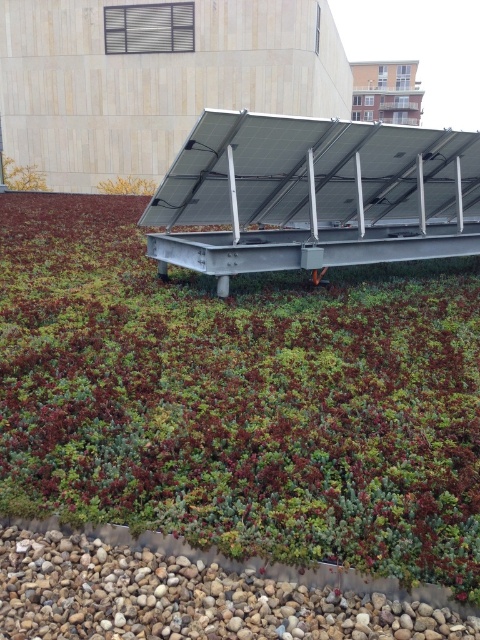
Question: Which of the following is the farthest from the observer?

Choices:
 (A) (377, 451)
 (B) (127, 189)
 (C) (434, 211)

Answer: (B)

Question: Is transparent glass solar panel at upper center thinner than yellow leafy plant at upper left?

Choices:
 (A) no
 (B) yes

Answer: (A)

Question: Is green succulent at center above transparent glass solar panel at upper center?

Choices:
 (A) no
 (B) yes

Answer: (A)

Question: Among these objects, which one is nearest to the camera?

Choices:
 (A) green succulent at center
 (B) transparent glass solar panel at upper center

Answer: (A)

Question: Observing the image, what is the correct spatial positioning of transparent glass solar panel at upper center in reference to yellow leafy plant at upper left?

Choices:
 (A) above
 (B) below

Answer: (B)

Question: Which point is farther to the camera?

Choices:
 (A) pyautogui.click(x=225, y=144)
 (B) pyautogui.click(x=265, y=513)
 (C) pyautogui.click(x=103, y=189)

Answer: (C)